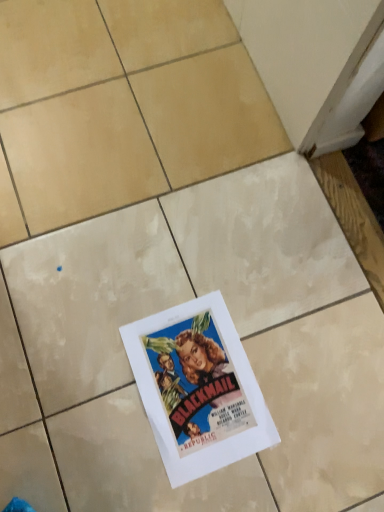
Locate an element on the screen. free spot below matte paper poster at center (from a real-world perspective) is located at coordinates (198, 384).